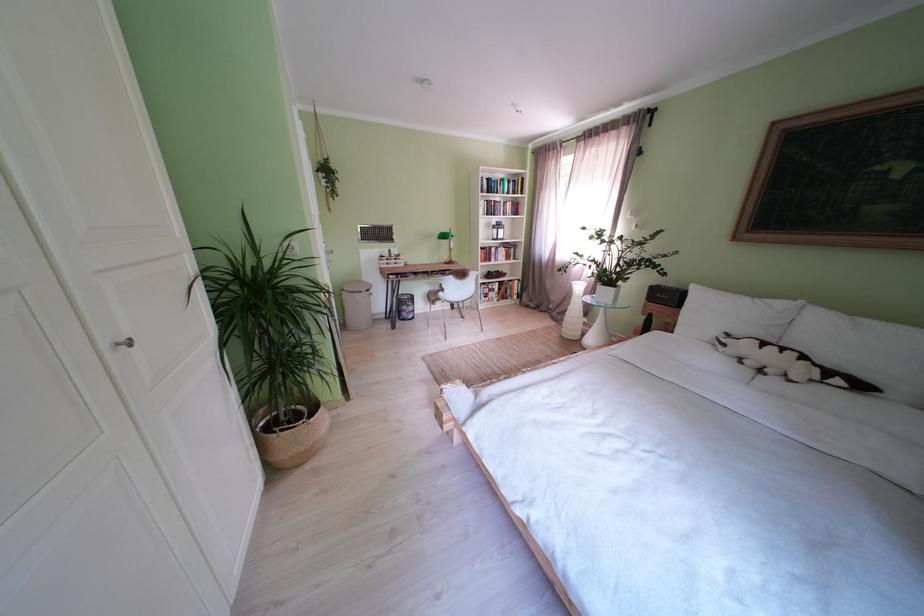
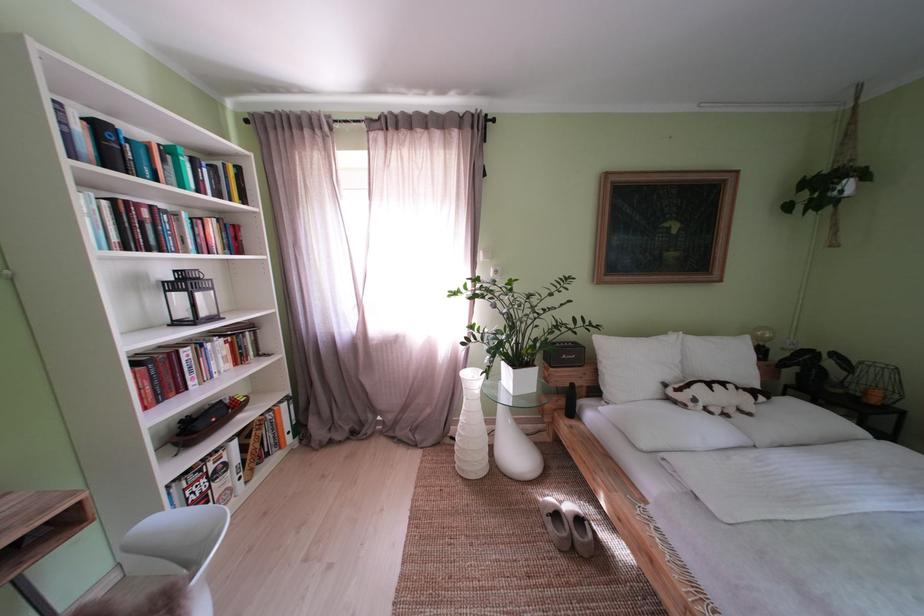
In the second image, find the point that corresponds to (x=716, y=317) in the first image.

(639, 369)